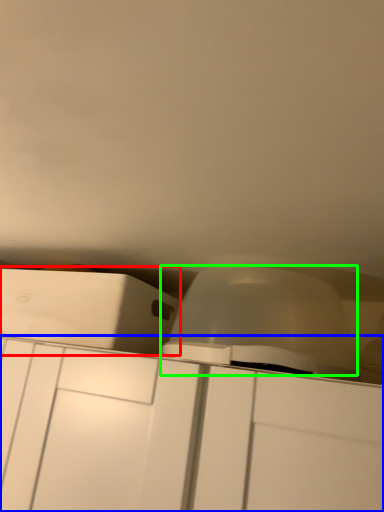
Question: Which is nearer to the cabinetry (highlighted by a red box)? cabinetry (highlighted by a blue box) or lift (highlighted by a green box).

Choices:
 (A) cabinetry
 (B) lift

Answer: (A)